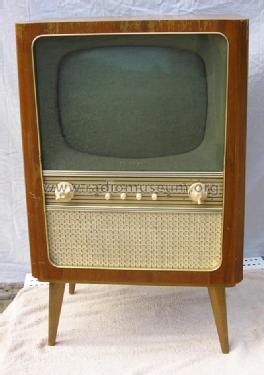
Where is `tv leg`? tv leg is located at coordinates (223, 314), (72, 289), (55, 314).